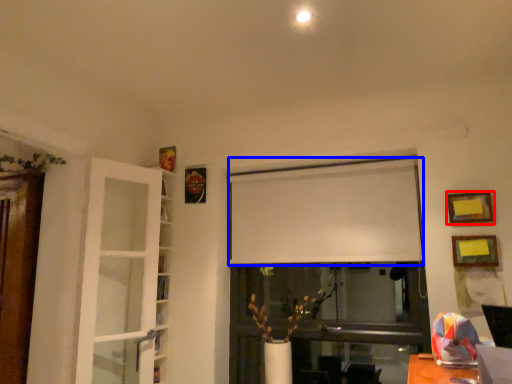
Question: Which of the following is the farthest to the observer, picture frame (highlighted by a red box) or curtain (highlighted by a blue box)?

Choices:
 (A) picture frame
 (B) curtain

Answer: (B)